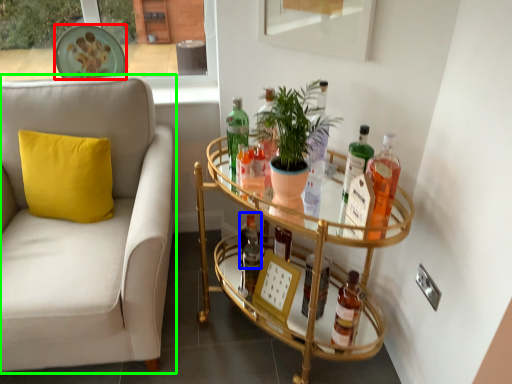
Question: Based on their relative distances, which object is farther from plate (highlighted by a red box)? Choose from bottle (highlighted by a blue box) and studio couch (highlighted by a green box).

Choices:
 (A) bottle
 (B) studio couch

Answer: (A)